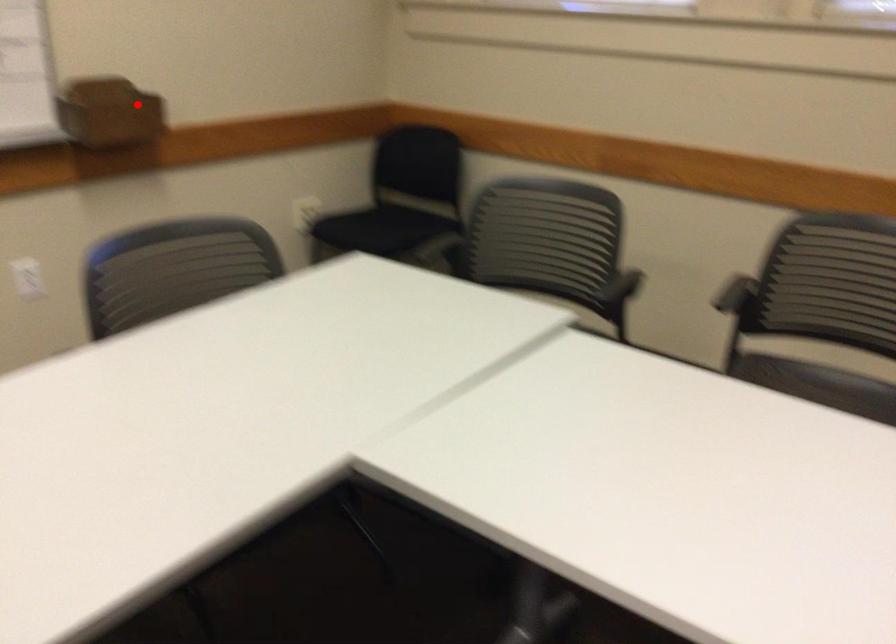
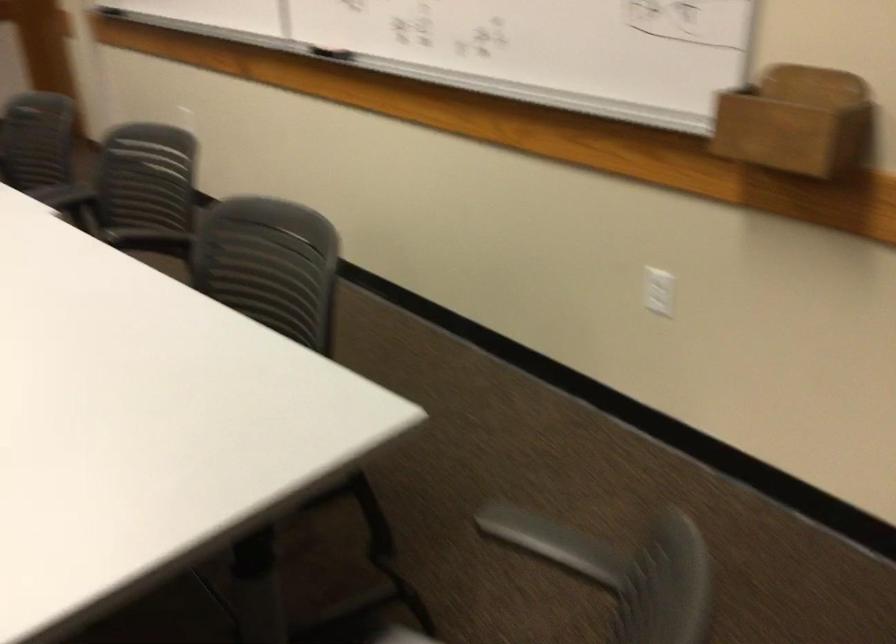
Locate, in the second image, the point that corresponds to the highlighted location in the first image.

(797, 122)